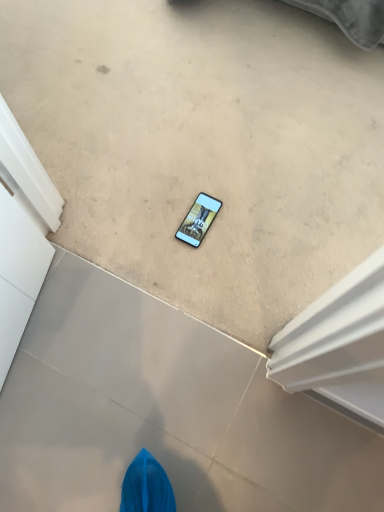
Question: From a real-world perspective, is matte gray concrete at center, the first concrete ordered from the bottom, positioned over beige carpet at center, acting as the 1th concrete starting from the top, based on gravity?

Choices:
 (A) yes
 (B) no

Answer: (B)

Question: Is matte gray concrete at center, the first concrete ordered from the bottom, outside beige carpet at center, which is the second concrete from bottom to top?

Choices:
 (A) no
 (B) yes

Answer: (B)

Question: Can you confirm if matte gray concrete at center, the first concrete ordered from the bottom, is wider than beige carpet at center, which is the second concrete from bottom to top?

Choices:
 (A) yes
 (B) no

Answer: (B)

Question: Is matte gray concrete at center, the 2th concrete in the top-to-bottom sequence, with beige carpet at center, which is the second concrete from bottom to top?

Choices:
 (A) no
 (B) yes

Answer: (A)

Question: From the image's perspective, does matte gray concrete at center, the first concrete ordered from the bottom, appear higher than beige carpet at center, which is the second concrete from bottom to top?

Choices:
 (A) no
 (B) yes

Answer: (A)

Question: Is matte gray concrete at center, the 2th concrete in the top-to-bottom sequence, facing towards beige carpet at center, acting as the 1th concrete starting from the top?

Choices:
 (A) no
 (B) yes

Answer: (B)

Question: Could matte gray concrete at center, the 2th concrete in the top-to-bottom sequence, be considered to be inside matte black phone at center?

Choices:
 (A) no
 (B) yes

Answer: (A)

Question: Considering the relative positions of matte black phone at center and matte gray concrete at center, the first concrete ordered from the bottom, in the image provided, is matte black phone at center behind matte gray concrete at center, the first concrete ordered from the bottom,?

Choices:
 (A) yes
 (B) no

Answer: (A)

Question: From a real-world perspective, is matte black phone at center over matte gray concrete at center, the 2th concrete in the top-to-bottom sequence?

Choices:
 (A) yes
 (B) no

Answer: (A)

Question: Does matte black phone at center have a lesser height compared to matte gray concrete at center, the 2th concrete in the top-to-bottom sequence?

Choices:
 (A) yes
 (B) no

Answer: (A)

Question: Considering the relative sizes of matte black phone at center and matte gray concrete at center, the first concrete ordered from the bottom, in the image provided, is matte black phone at center smaller than matte gray concrete at center, the first concrete ordered from the bottom,?

Choices:
 (A) yes
 (B) no

Answer: (A)

Question: Is matte black phone at center completely or partially outside of matte gray concrete at center, the first concrete ordered from the bottom?

Choices:
 (A) yes
 (B) no

Answer: (A)

Question: Is the depth of beige carpet at center, which is the second concrete from bottom to top, less than that of matte gray concrete at center, the 2th concrete in the top-to-bottom sequence?

Choices:
 (A) yes
 (B) no

Answer: (B)